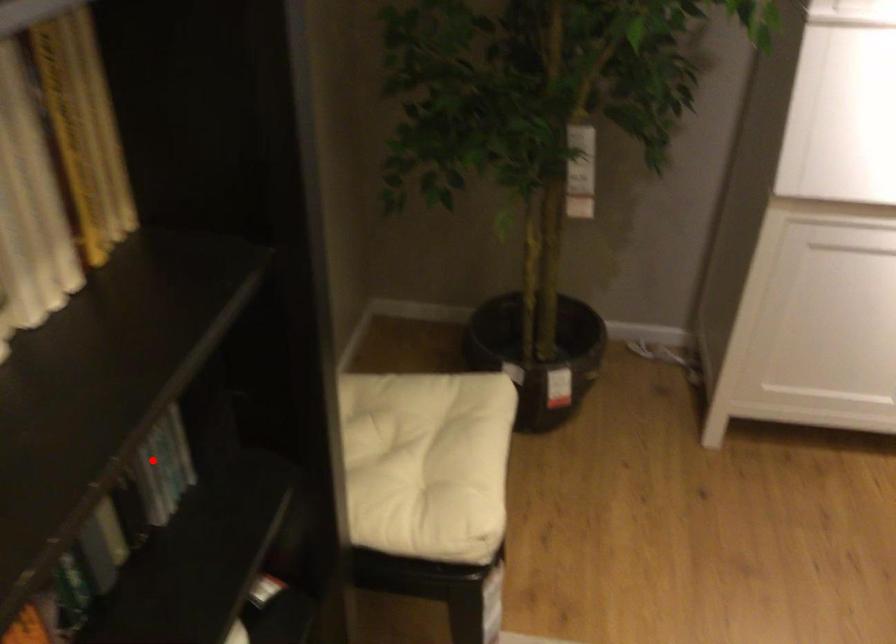
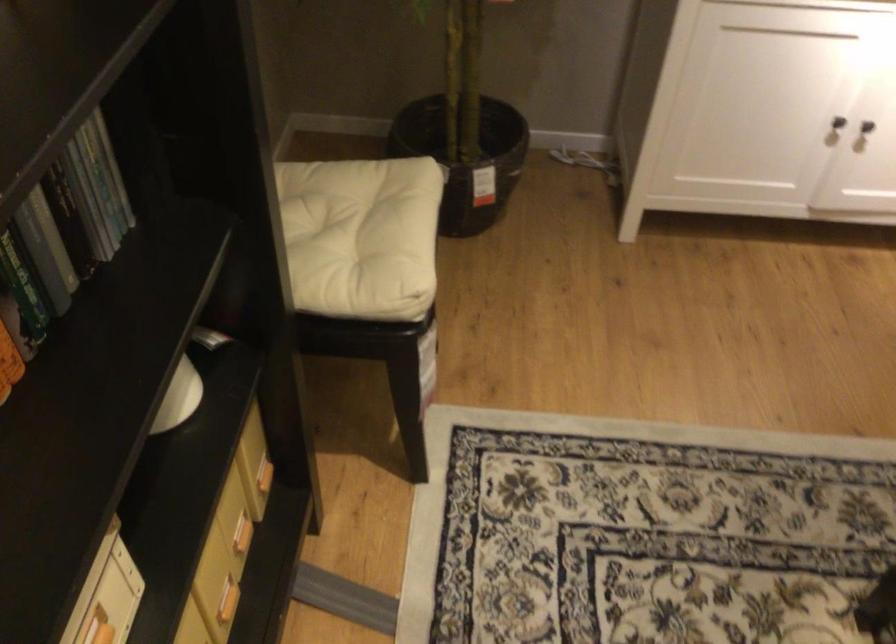
Locate, in the second image, the point that corresponds to the highlighted location in the first image.

(95, 198)